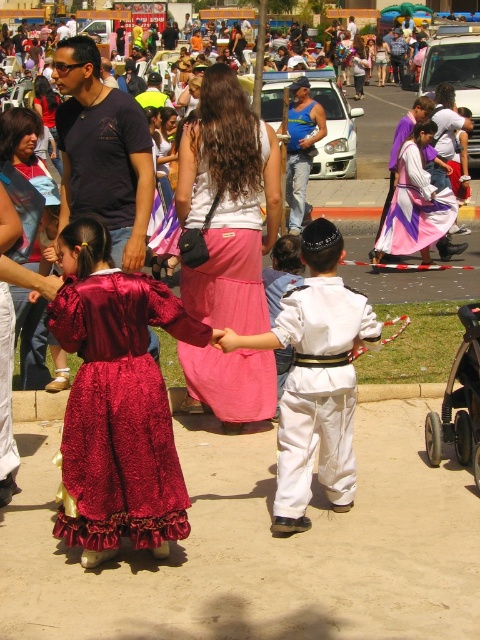
Is velvet burgundy dress at lower left taller than black plastic baby carriage at lower right?

Indeed, velvet burgundy dress at lower left has a greater height compared to black plastic baby carriage at lower right.

Does velvet burgundy dress at lower left appear over black plastic baby carriage at lower right?

Actually, velvet burgundy dress at lower left is below black plastic baby carriage at lower right.

From the picture: Measure the distance between point (96,401) and camera.

3.85 meters

Where is `velvet burgundy dress at lower left`? This screenshot has height=640, width=480. velvet burgundy dress at lower left is located at coordinates (120, 412).

Who is positioned more to the left, white cotton outfit at center or pink satin skirt at center?

pink satin skirt at center is more to the left.

The width and height of the screenshot is (480, 640). Describe the element at coordinates (315, 378) in the screenshot. I see `white cotton outfit at center` at that location.

At what (x,y) coordinates should I click in order to perform the action: click on white cotton outfit at center. Please return your answer as a coordinate pair (x, y). Image resolution: width=480 pixels, height=640 pixels. Looking at the image, I should click on (315, 378).

Between velvet burgundy dress at lower left and white cotton outfit at center, which one has less height?

velvet burgundy dress at lower left is shorter.

Can you confirm if velvet burgundy dress at lower left is wider than white cotton outfit at center?

In fact, velvet burgundy dress at lower left might be narrower than white cotton outfit at center.

At what (x,y) coordinates should I click in order to perform the action: click on velvet burgundy dress at lower left. Please return your answer as a coordinate pair (x, y). The width and height of the screenshot is (480, 640). Looking at the image, I should click on (120, 412).